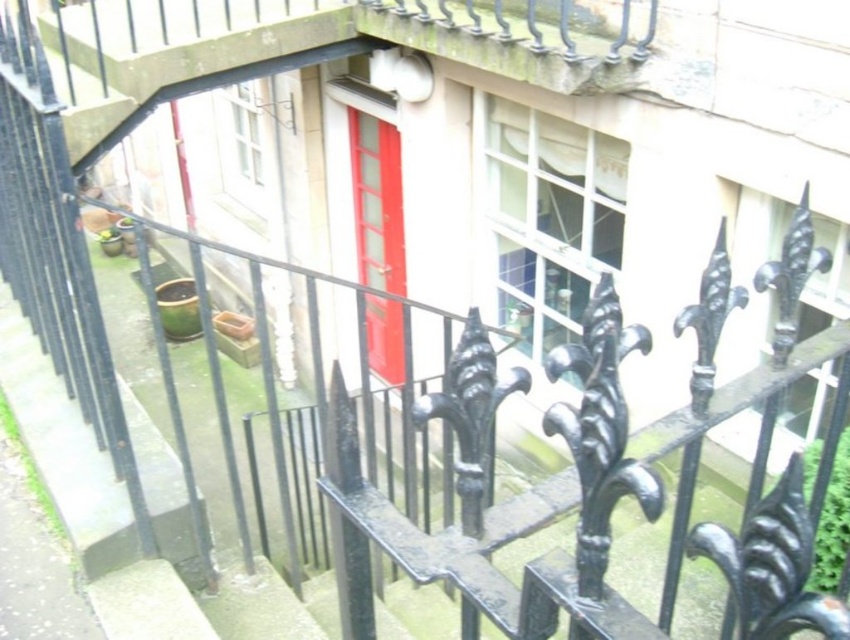
Can you confirm if smooth concrete balcony at upper center is smaller than matte red door at center?

Incorrect, smooth concrete balcony at upper center is not smaller in size than matte red door at center.

Is point (78, 132) in front of point (394, 268)?

Yes.

You are a GUI agent. You are given a task and a screenshot of the screen. Output one action in this format:
    pyautogui.click(x=<x>, y=<y>)
    Task: Click on the smooth concrete balcony at upper center
    The image size is (850, 640).
    Given the screenshot: What is the action you would take?
    pyautogui.click(x=310, y=48)

Locate an element on the screen. smooth concrete balcony at upper center is located at coordinates (310, 48).